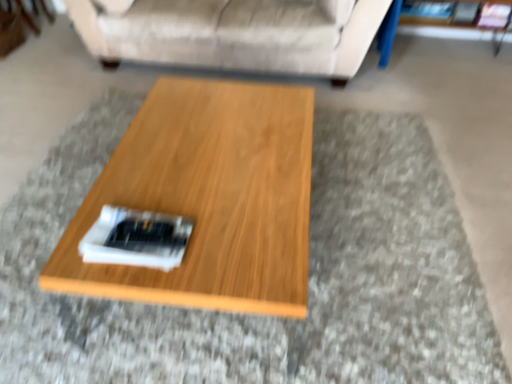
Question: Is wooden coffee table at center wider or thinner than beige fabric couch at upper center?

Choices:
 (A) wide
 (B) thin

Answer: (B)

Question: Based on their sizes in the image, would you say wooden coffee table at center is bigger or smaller than beige fabric couch at upper center?

Choices:
 (A) small
 (B) big

Answer: (A)

Question: Would you say wooden coffee table at center is inside or outside beige fabric couch at upper center?

Choices:
 (A) inside
 (B) outside

Answer: (B)

Question: From the image's perspective, is beige fabric couch at upper center positioned above or below wooden coffee table at center?

Choices:
 (A) below
 (B) above

Answer: (B)

Question: Relative to wooden coffee table at center, is beige fabric couch at upper center in front or behind?

Choices:
 (A) behind
 (B) front

Answer: (A)

Question: In the image, is beige fabric couch at upper center on the left side or the right side of wooden coffee table at center?

Choices:
 (A) right
 (B) left

Answer: (B)

Question: Looking at the image, does beige fabric couch at upper center seem bigger or smaller compared to wooden coffee table at center?

Choices:
 (A) big
 (B) small

Answer: (A)